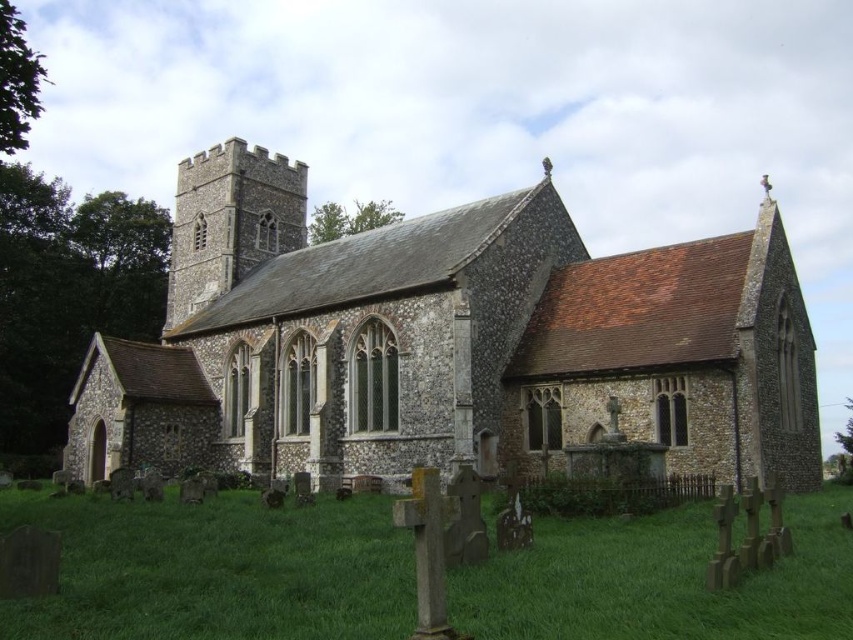
Between stone church at center and green grass at lower center, which one appears on the right side from the viewer's perspective?

From the viewer's perspective, green grass at lower center appears more on the right side.

Is point (277, 413) closer to camera compared to point (71, 557)?

No, (277, 413) is further to viewer.

The image size is (853, 640). In order to click on stone church at center in this screenshot , I will do click(445, 342).